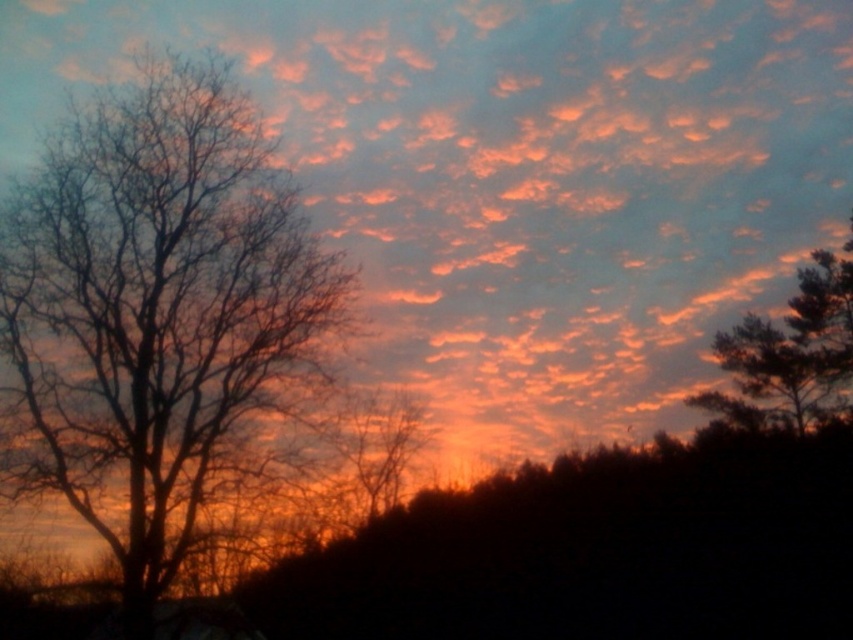
Question: Is silhouette bark tree at left below silhouette bare tree at center?

Choices:
 (A) yes
 (B) no

Answer: (B)

Question: Which of these objects is positioned closest to the silvery textured pine tree at upper right?

Choices:
 (A) silhouette bare tree at center
 (B) silhouette bark tree at left

Answer: (A)

Question: Which object is the closest to the silhouette bark tree at left?

Choices:
 (A) silvery textured pine tree at upper right
 (B) silhouette bare tree at center

Answer: (B)

Question: Which point is farther from the camera taking this photo?

Choices:
 (A) (805, 280)
 (B) (248, 100)
 (C) (364, 413)

Answer: (A)

Question: Does silhouette bark tree at left have a greater width compared to silvery textured pine tree at upper right?

Choices:
 (A) no
 (B) yes

Answer: (B)

Question: Where is silhouette bark tree at left located in relation to silvery textured pine tree at upper right in the image?

Choices:
 (A) right
 (B) left

Answer: (B)